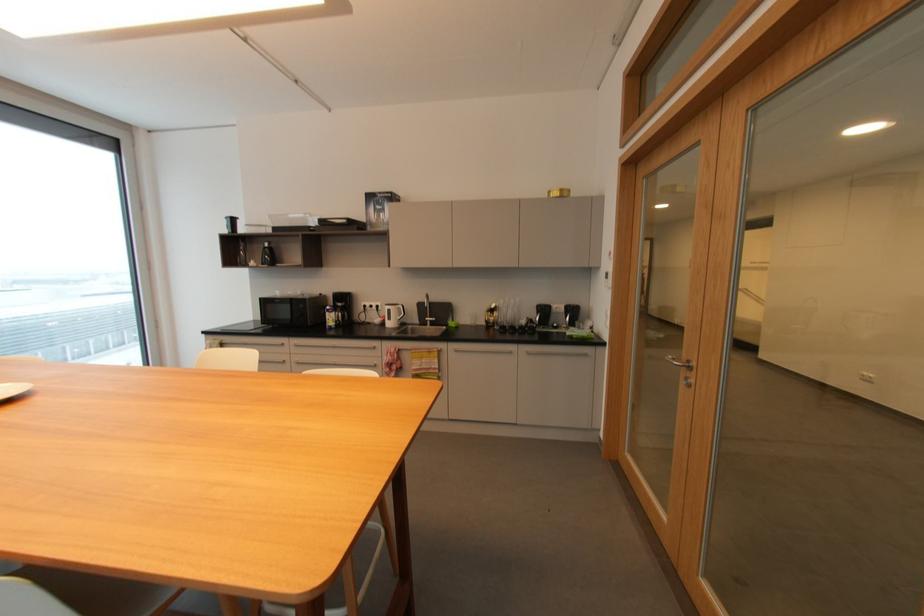
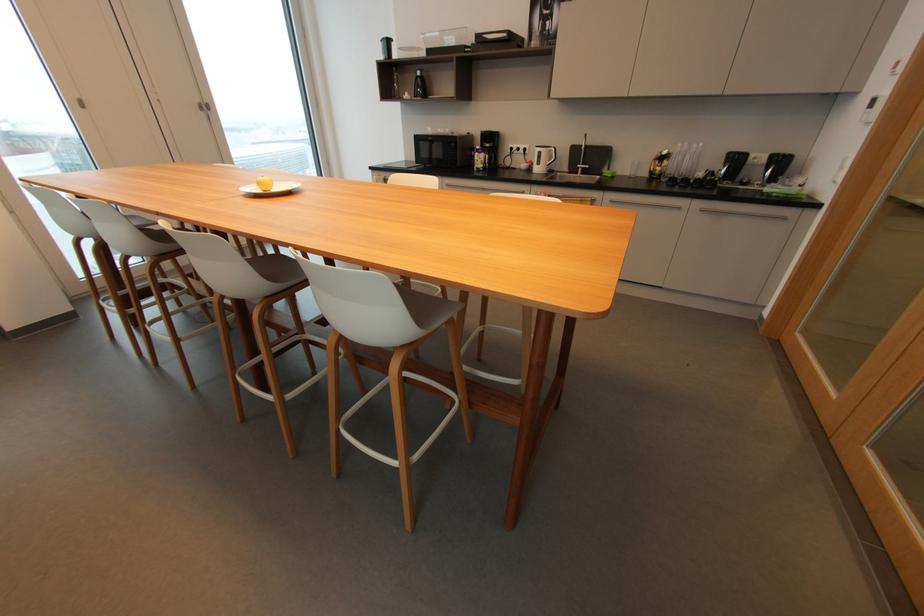
In the second image, find the point that corresponds to (x=499, y=313) in the first image.

(669, 161)